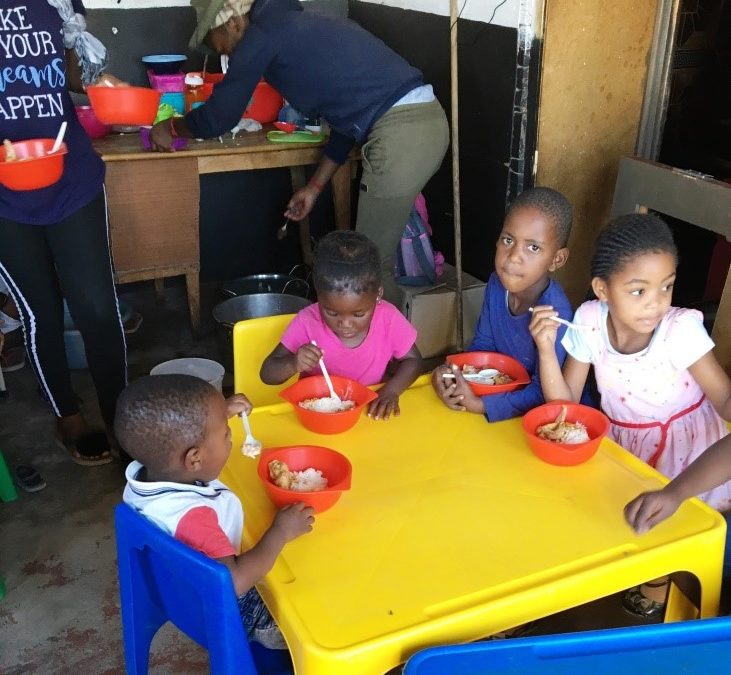
This screenshot has height=675, width=731. In order to click on red bowl in this screenshot , I will do `click(325, 481)`.